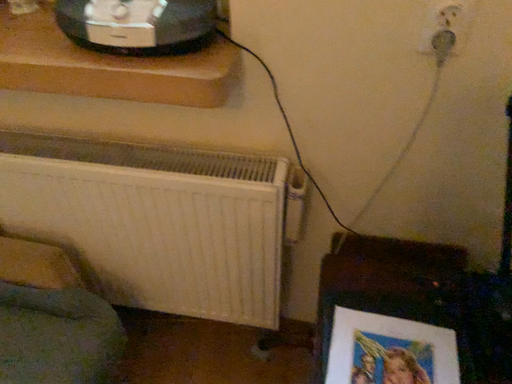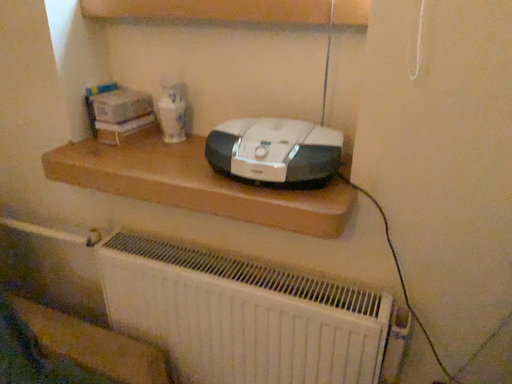
Question: Which way did the camera rotate in the video?

Choices:
 (A) rotated right
 (B) rotated left

Answer: (B)